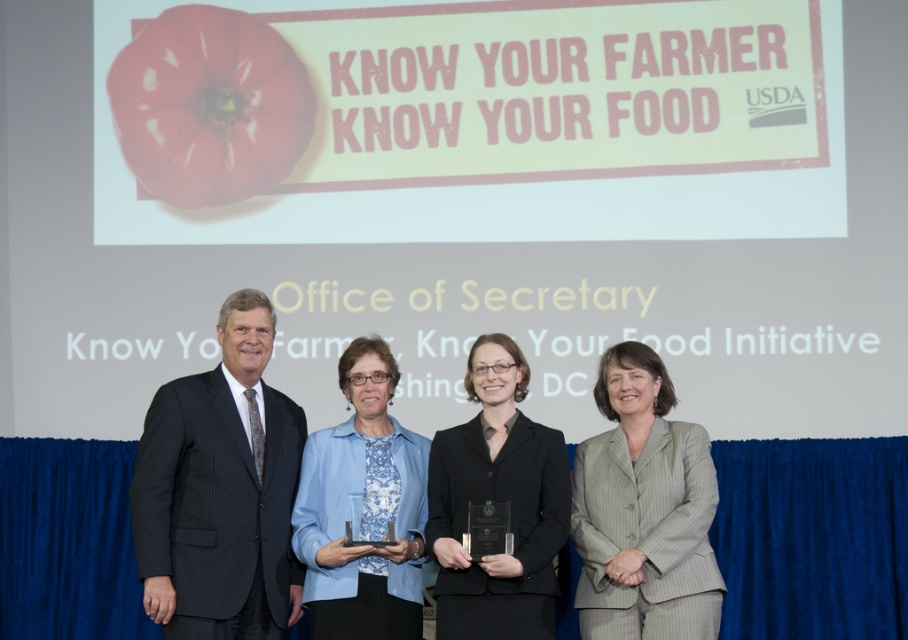
You are attending an event where you see the gray pinstripe suit at center and the matte red tomato at upper left. Which object takes up more space in the image?

The gray pinstripe suit at center is bigger than the matte red tomato at upper left, so it takes up more space in the image.

You are standing at the origin point in the image and want to move towards the black glossy suit at center. Which direction should you move in?

The black glossy suit at center is located at point 0.783 on the x axis and 0.550 on the y axis. Since you are at the origin point, you should move towards the right and slightly upwards to reach the black glossy suit at center.